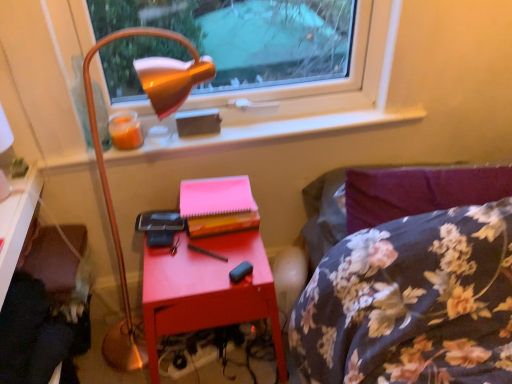
Question: Considering the positions of matte red nightstand at center and matte wood desk at lower left in the image, is matte red nightstand at center wider or thinner than matte wood desk at lower left?

Choices:
 (A) thin
 (B) wide

Answer: (B)

Question: From the image's perspective, is matte red nightstand at center above or below matte wood desk at lower left?

Choices:
 (A) below
 (B) above

Answer: (A)

Question: Which of these objects is positioned closest to the matte red nightstand at center?

Choices:
 (A) metallic gold lamp at upper left
 (B) matte plastic window sill at upper center
 (C) pink paper at center
 (D) velvet purple swivel chair at lower left
 (E) matte wood desk at lower left

Answer: (C)

Question: Which is nearer to the metallic gold lamp at upper left?

Choices:
 (A) matte plastic window sill at upper center
 (B) velvet purple swivel chair at lower left
 (C) matte wood desk at lower left
 (D) matte red nightstand at center
 (E) wooden table at lower left

Answer: (D)